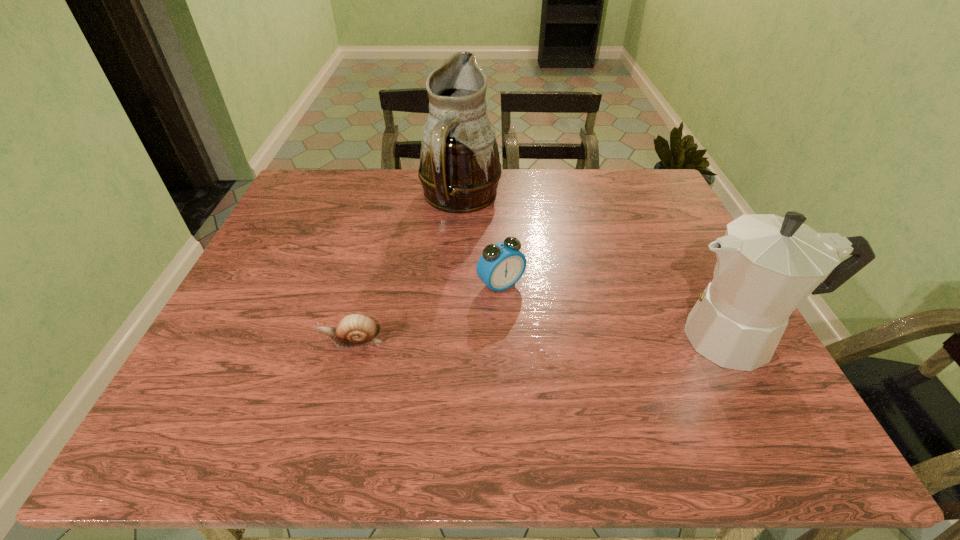
The width and height of the screenshot is (960, 540). In order to click on object that ranks as the third closest to the coffeepot in this screenshot , I will do pos(354,330).

Select which object is the closest to the pitcher. Please provide its 2D coordinates. Your answer should be formatted as a tuple, i.e. [(x, y)], where the tuple contains the x and y coordinates of a point satisfying the conditions above.

[(501, 265)]

Image resolution: width=960 pixels, height=540 pixels. I want to click on vacant space that satisfies the following two spatial constraints: 1. on the front side of the pitcher; 2. at the spout of the rightmost object, so click(452, 338).

The width and height of the screenshot is (960, 540). I want to click on free space that satisfies the following two spatial constraints: 1. on the front side of the third nearest object; 2. at the spout of the rightmost object, so click(504, 338).